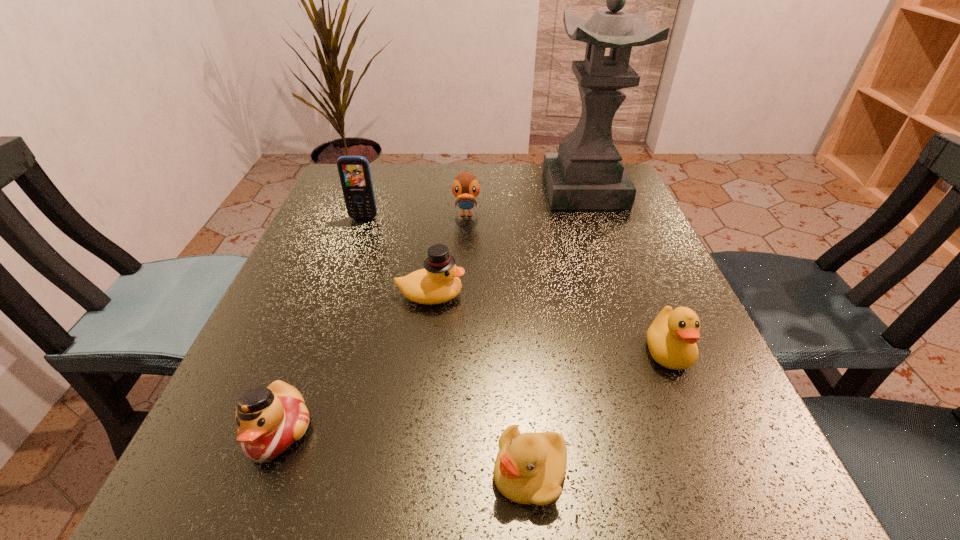
Where is `vacant area at the right edge of the desktop`? This screenshot has width=960, height=540. vacant area at the right edge of the desktop is located at coordinates (659, 292).

The height and width of the screenshot is (540, 960). What are the coordinates of `vacant space at the far left corner` in the screenshot? It's located at 390,172.

This screenshot has height=540, width=960. Find the location of `vacant area that lies between the cellular telephone and the second farthest duck`. vacant area that lies between the cellular telephone and the second farthest duck is located at coordinates (397, 256).

This screenshot has height=540, width=960. Identify the location of vacant area between the third farthest duck and the sculpture. (626, 271).

Locate an element on the screen. The image size is (960, 540). vacant point located between the fifth object from left to right and the sixth shortest object is located at coordinates (446, 345).

Locate an element on the screen. empty location between the tallest object and the farthest duck is located at coordinates (525, 202).

Where is `free space that is in between the second farthest duck and the shortest object`? The height and width of the screenshot is (540, 960). free space that is in between the second farthest duck and the shortest object is located at coordinates (480, 383).

Locate an element on the screen. empty space that is in between the nearest duck and the rightmost duck is located at coordinates (472, 392).

Identify the location of free space between the fourth nearest object and the tallest object. The width and height of the screenshot is (960, 540). (508, 242).

Locate an element on the screen. The image size is (960, 540). free space between the third object from right to left and the fifth farthest object is located at coordinates (598, 412).